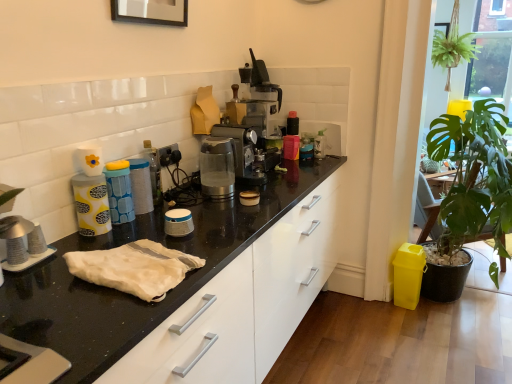
Question: Is white fabric at center facing towards transparent plastic coffee machine at center, positioned as the first coffee machine in front-to-back order?

Choices:
 (A) yes
 (B) no

Answer: (B)

Question: Can transparent plastic coffee machine at center, positioned as the first coffee machine in front-to-back order, be found inside white fabric at center?

Choices:
 (A) yes
 (B) no

Answer: (B)

Question: From the image's perspective, is white fabric at center below transparent plastic coffee machine at center, positioned as the first coffee machine in front-to-back order?

Choices:
 (A) no
 (B) yes

Answer: (B)

Question: From the image's perspective, is white fabric at center over transparent plastic coffee machine at center, positioned as the first coffee machine in front-to-back order?

Choices:
 (A) no
 (B) yes

Answer: (A)

Question: Is white fabric at center bigger than transparent plastic coffee machine at center, the 2th coffee machine in the back-to-front sequence?

Choices:
 (A) yes
 (B) no

Answer: (B)

Question: Are white fabric at center and transparent plastic coffee machine at center, the 2th coffee machine in the back-to-front sequence, located far from each other?

Choices:
 (A) no
 (B) yes

Answer: (A)

Question: Could you tell me if satin silver coffee machine at center, which is the second coffee machine from front to back, is turned towards green leafy plant at upper right?

Choices:
 (A) no
 (B) yes

Answer: (A)

Question: Is there a large distance between satin silver coffee machine at center, arranged as the 1th coffee machine when viewed from the back, and green leafy plant at upper right?

Choices:
 (A) yes
 (B) no

Answer: (A)

Question: Is satin silver coffee machine at center, which is the second coffee machine from front to back, positioned in front of green leafy plant at upper right?

Choices:
 (A) yes
 (B) no

Answer: (A)

Question: From a real-world perspective, is satin silver coffee machine at center, arranged as the 1th coffee machine when viewed from the back, located beneath green leafy plant at upper right?

Choices:
 (A) yes
 (B) no

Answer: (A)

Question: Is satin silver coffee machine at center, arranged as the 1th coffee machine when viewed from the back, to the right of green leafy plant at upper right from the viewer's perspective?

Choices:
 (A) yes
 (B) no

Answer: (B)

Question: From the image's perspective, is satin silver coffee machine at center, arranged as the 1th coffee machine when viewed from the back, on green leafy plant at upper right?

Choices:
 (A) no
 (B) yes

Answer: (A)

Question: Can white fabric at center be found inside transparent plastic coffee machine at center, positioned as the first coffee machine in front-to-back order?

Choices:
 (A) no
 (B) yes

Answer: (A)